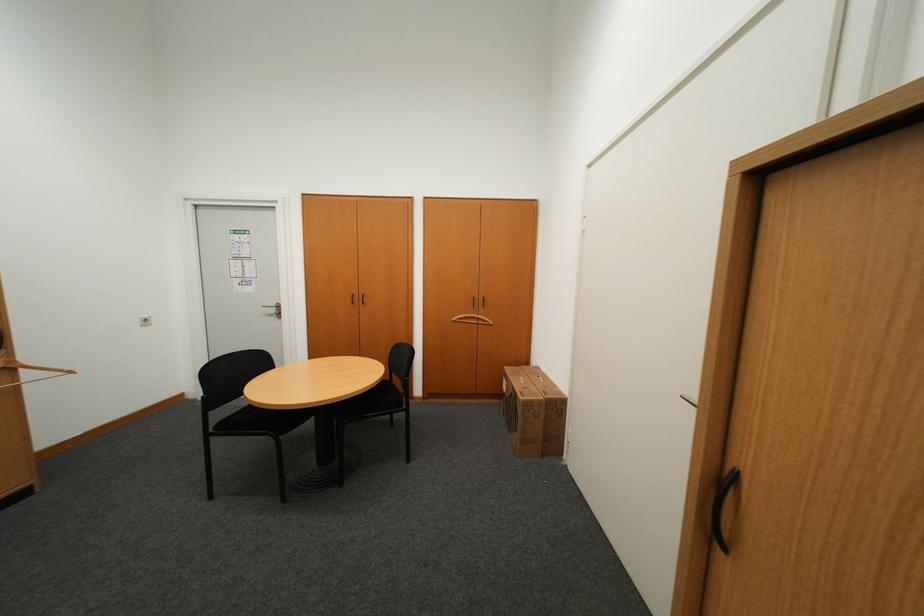
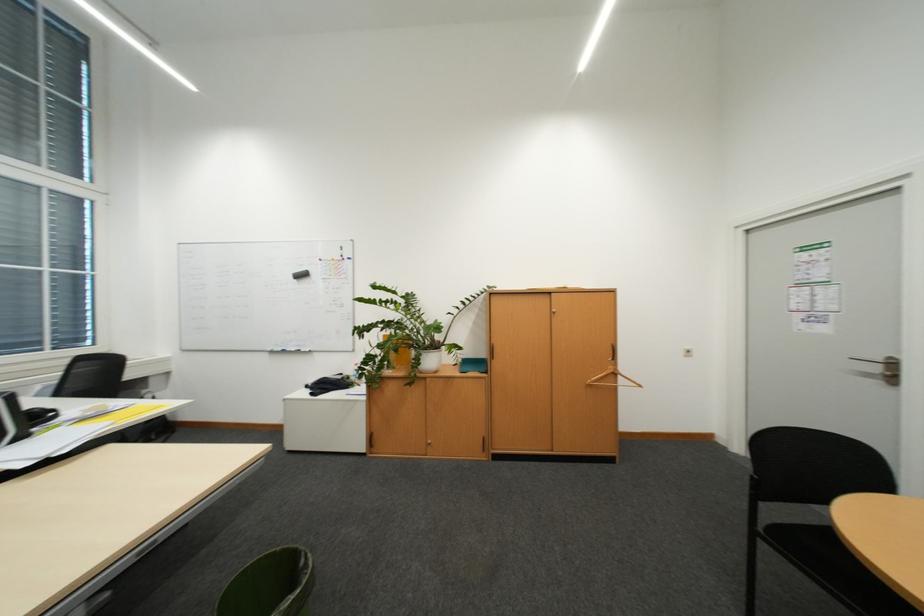
Question: Based on the continuous images, in which direction is the camera rotating? Reply with the corresponding letter.

Choices:
 (A) Left
 (B) Right
 (C) Up
 (D) Down

Answer: (A)